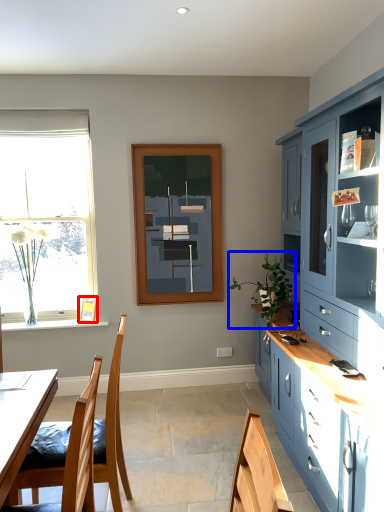
Question: Which point is closer to the camera, picture frame (highlighted by a red box) or houseplant (highlighted by a blue box)?

Choices:
 (A) picture frame
 (B) houseplant

Answer: (B)